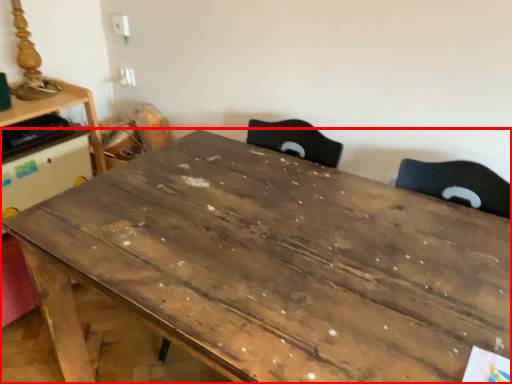
Question: Where is table (annotated by the red box) located in relation to table in the image?

Choices:
 (A) left
 (B) right

Answer: (B)